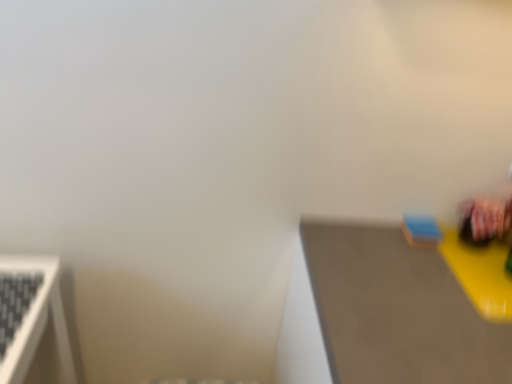
Where is `free location to the right of blue matte sponge at upper right, which is the first toy in left-to-right order`? free location to the right of blue matte sponge at upper right, which is the first toy in left-to-right order is located at coordinates (476, 246).